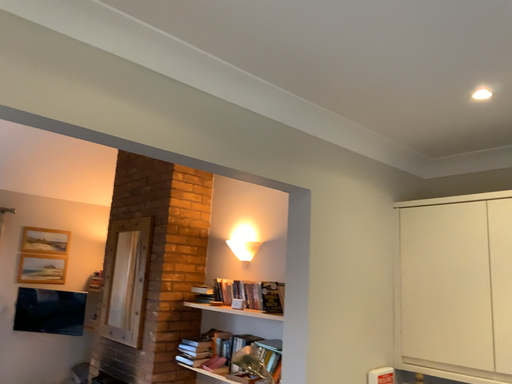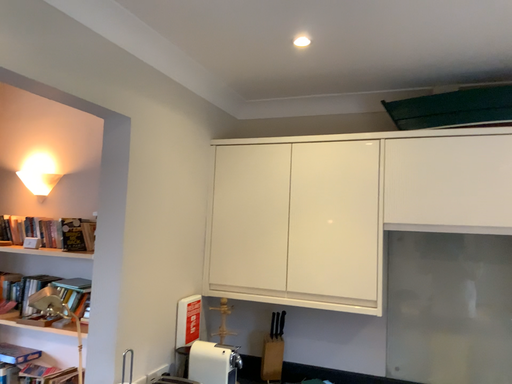
Question: Which way did the camera rotate in the video?

Choices:
 (A) rotated upward
 (B) rotated downward

Answer: (B)